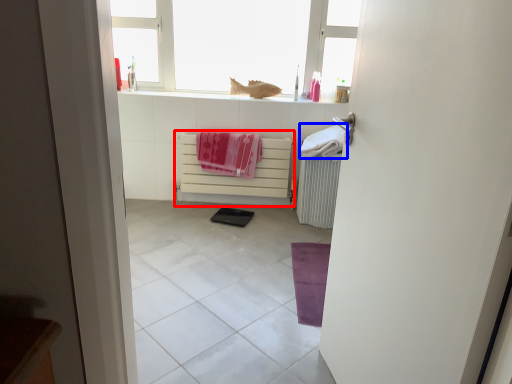
Question: Which object is closer to the camera taking this photo, cabinetry (highlighted by a red box) or beach towel (highlighted by a blue box)?

Choices:
 (A) cabinetry
 (B) beach towel

Answer: (B)